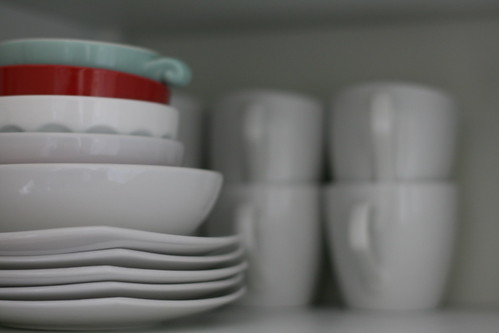
Where is `bowl`? The image size is (499, 333). bowl is located at coordinates (167, 204), (137, 151), (121, 108), (105, 88), (121, 64).